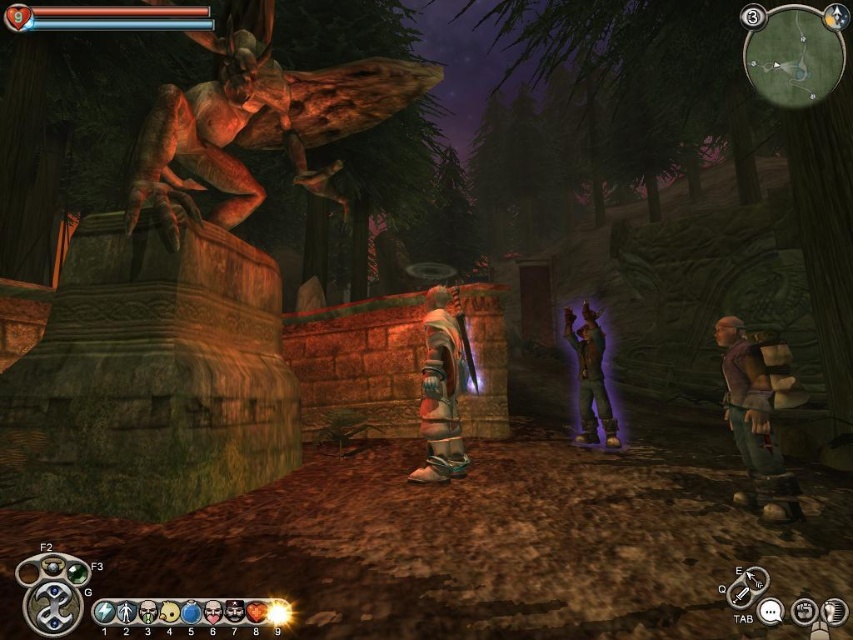
Does purple fabric backpack at lower right have a lesser width compared to shiny silver armor at center?

No.

Does point (775, 472) come in front of point (439, 289)?

Yes, point (775, 472) is in front of point (439, 289).

Between point (751, 433) and point (444, 474), which one is positioned behind?

The point (444, 474) is behind.

Identify the location of purple fabric backpack at lower right. (753, 424).

Who is more forward, (x=453, y=452) or (x=602, y=388)?

Point (x=453, y=452)

Between point (431, 417) and point (601, 394), which one is positioned in front?

Point (431, 417) is more forward.

You are a GUI agent. You are given a task and a screenshot of the screen. Output one action in this format:
    pyautogui.click(x=<x>, y=<y>)
    Task: Click on the shiny silver armor at center
    Image resolution: width=853 pixels, height=640 pixels.
    Given the screenshot: What is the action you would take?
    pyautogui.click(x=440, y=388)

Is point (769, 509) behind point (566, 330)?

No, (769, 509) is in front of (566, 330).

Is the position of purple fabric backpack at lower right less distant than that of leather jacket at center?

Yes.

This screenshot has width=853, height=640. I want to click on purple fabric backpack at lower right, so click(753, 424).